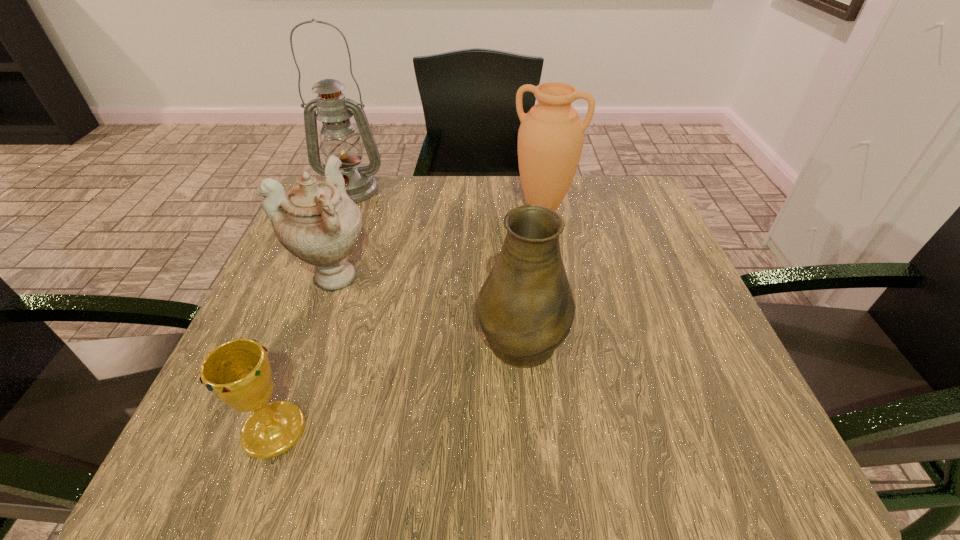
This screenshot has height=540, width=960. I want to click on chalice that is positioned at the left edge, so click(x=238, y=372).

This screenshot has width=960, height=540. In order to click on object that is positioned at the far left corner in this screenshot , I will do `click(339, 137)`.

Locate an element on the screen. This screenshot has height=540, width=960. object that is at the near left corner is located at coordinates (238, 372).

Locate an element on the screen. The image size is (960, 540). vacant region at the far edge of the desktop is located at coordinates coord(453,197).

You are a GUI agent. You are given a task and a screenshot of the screen. Output one action in this format:
    pyautogui.click(x=<x>, y=<y>)
    Task: Click on the free location at the near edge
    Image resolution: width=960 pixels, height=540 pixels.
    Given the screenshot: What is the action you would take?
    pyautogui.click(x=448, y=456)

This screenshot has width=960, height=540. I want to click on free space at the left edge of the desktop, so click(x=284, y=350).

Where is `vacant space at the right edge`? vacant space at the right edge is located at coordinates (678, 373).

Image resolution: width=960 pixels, height=540 pixels. Find the location of `free region at the near left corner of the desktop`. free region at the near left corner of the desktop is located at coordinates (219, 460).

Locate an element on the screen. This screenshot has height=540, width=960. free space at the near right corner of the desktop is located at coordinates (756, 464).

The image size is (960, 540). Identify the location of vacant area that lies between the left urn and the farther urn. (439, 242).